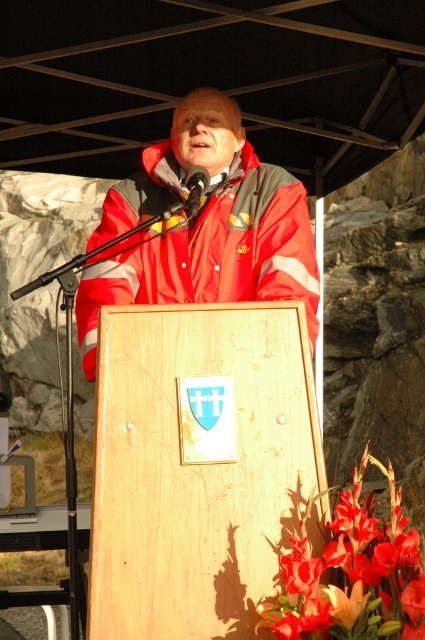
Does red matte jacket at center have a greater height compared to vivid red petals at lower right?

Yes, red matte jacket at center is taller than vivid red petals at lower right.

Which is more to the right, red matte jacket at center or vivid red petals at lower right?

From the viewer's perspective, vivid red petals at lower right appears more on the right side.

Is point (95, 269) more distant than point (408, 552)?

Yes.

At what (x,y) coordinates should I click in order to perform the action: click on red matte jacket at center. Please return your answer as a coordinate pair (x, y). Looking at the image, I should click on (203, 227).

Describe the element at coordinates (203, 227) in the screenshot. I see `red matte jacket at center` at that location.

Which is behind, point (136, 177) or point (187, 179)?

The point (136, 177) is behind.

Between point (189, 264) and point (201, 173), which one is positioned in front?

Positioned in front is point (201, 173).

Locate an element on the screen. Image resolution: width=425 pixels, height=640 pixels. red matte jacket at center is located at coordinates (203, 227).

Which is behind, point (333, 600) or point (184, 182)?

The point (184, 182) is more distant.

Who is positioned more to the right, vivid red petals at lower right or metallic black microphone at center?

Positioned to the right is vivid red petals at lower right.

I want to click on vivid red petals at lower right, so click(353, 573).

Where is `vivid red petals at lower right`? The image size is (425, 640). vivid red petals at lower right is located at coordinates (353, 573).